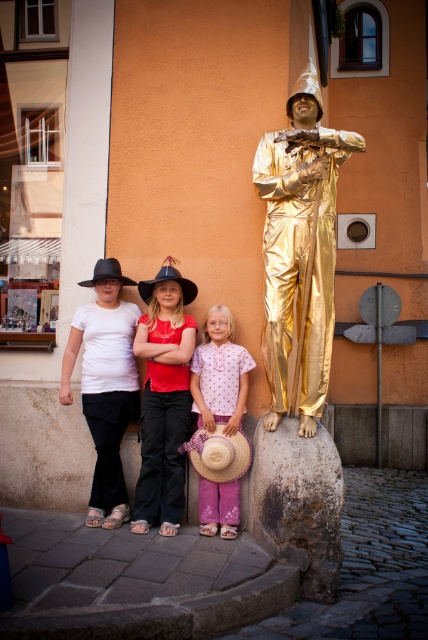
You are a photographer trying to capture the perfect shot of the pink fabric dress at center and the straw at right. Based on their positions, which object should you adjust to ensure both are centered in the frame?

The pink fabric dress at center is positioned on the left side of the straw at right. To center both objects in the frame, you should move the straw at right to the left so it aligns with the pink fabric dress at center.

You are a photographer trying to capture a photo of the gold shiny statue at center and the black felt cowboy hat at center. Since you want to ensure both are visible in the frame, which object should you focus on first to account for their sizes?

The gold shiny statue at center is much taller than the black felt cowboy hat at center, so you should focus on the statue first to ensure it fits properly in the frame before adjusting for the smaller hat.

In the scene shown: You are a photographer trying to capture a group photo of the children. The pink fabric dress at center and the straw at right are both in the frame. Which object takes up more horizontal space in the photo?

The pink fabric dress at center takes up more horizontal space in the photo because its width surpasses that of the straw at right.